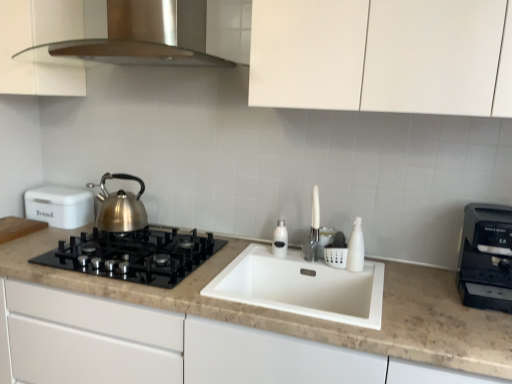
The height and width of the screenshot is (384, 512). I want to click on vacant area that lies to the right of white plastic bottle at sink, the 1th bottle when ordered from right to left, so click(377, 268).